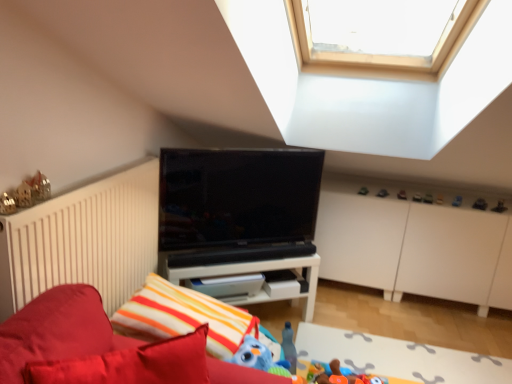
Question: In terms of height, does white soft rug at lower center look taller or shorter compared to blue rubber duck at upper center, placed as the 7th toy when sorted from back to front?

Choices:
 (A) tall
 (B) short

Answer: (B)

Question: From a real-world perspective, is white soft rug at lower center above or below blue rubber duck at upper center, the fifth toy from the front?

Choices:
 (A) below
 (B) above

Answer: (A)

Question: Which object is the farthest from the wooden house at left, acting as the 1th toy starting from the front?

Choices:
 (A) metallic black toy at upper right, the 4th toy viewed from the front
 (B) white soft rug at lower center
 (C) smooth plastic toy at center, marked as the eighth toy in a left-to-right arrangement
 (D) white matte dresser at center
 (E) velvet red bed at lower left

Answer: (A)

Question: Estimate the real-world distances between objects in this image. Which object is closer to the soft plush toy at lower center, placed as the 10th toy when sorted from back to front?

Choices:
 (A) metallic silver toy at upper right, the 9th toy positioned from the back
 (B) metallic black toy at upper right, the 4th toy viewed from the front
 (C) matte black toy car at upper center, the 9th toy in the front-to-back sequence
 (D) white matte shelf at center
 (E) white soft rug at lower center

Answer: (D)